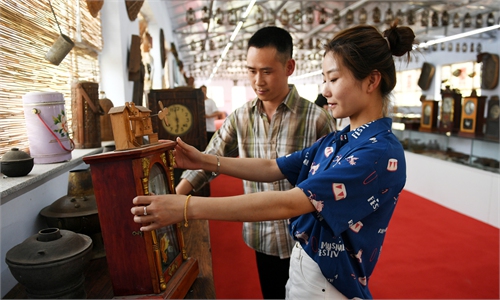
The width and height of the screenshot is (500, 300). I want to click on white floor, so click(x=457, y=183).